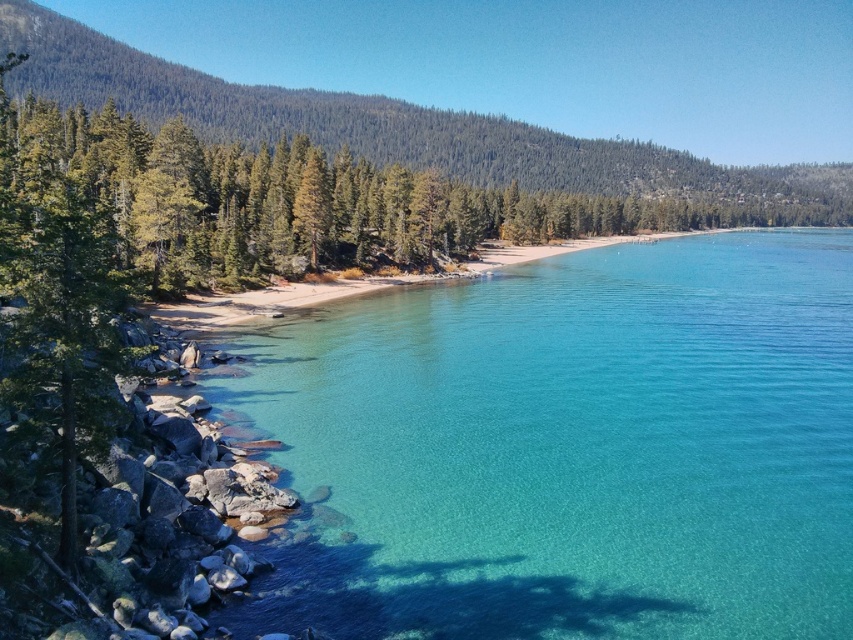
You are standing at the origin point in the image. Which direction should you move to reach the clear glassy water at center?

The clear glassy water at center is located at coordinates 0.702 on the x axis and 0.668 on the y axis. Since you are at the origin point, you should move towards the right and upwards to reach it.

Looking at this image, you are planning to take a photo of the clear glassy water at center and the green matte tree at left. Which object should you focus on first if you want to capture both in a single shot with maximum clarity?

The clear glassy water at center is bigger than the green matte tree at left, so focusing on the larger object first will ensure better clarity for both in the photo.